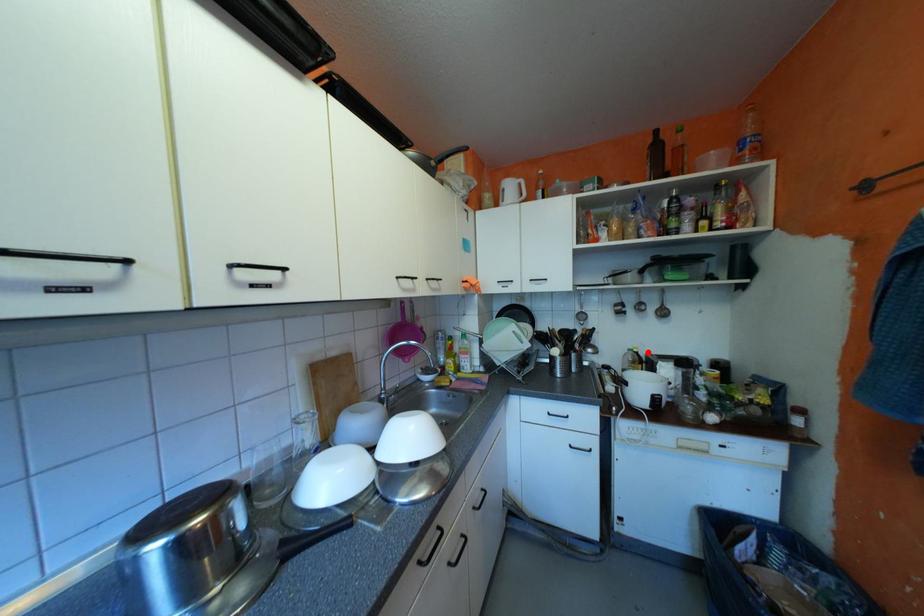
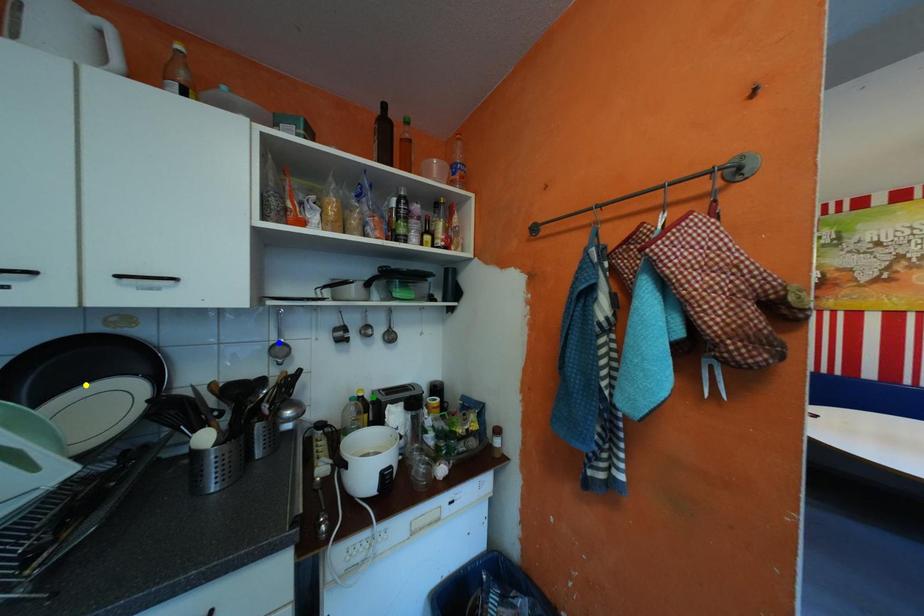
Question: I am providing you with two images of the same scene from different viewpoints. A red point is marked on the first image. You are given multiple points on the second image. Can you choose the point in image 2 that corresponds to the point in image 1?

Choices:
 (A) blue point
 (B) green point
 (C) yellow point

Answer: (B)